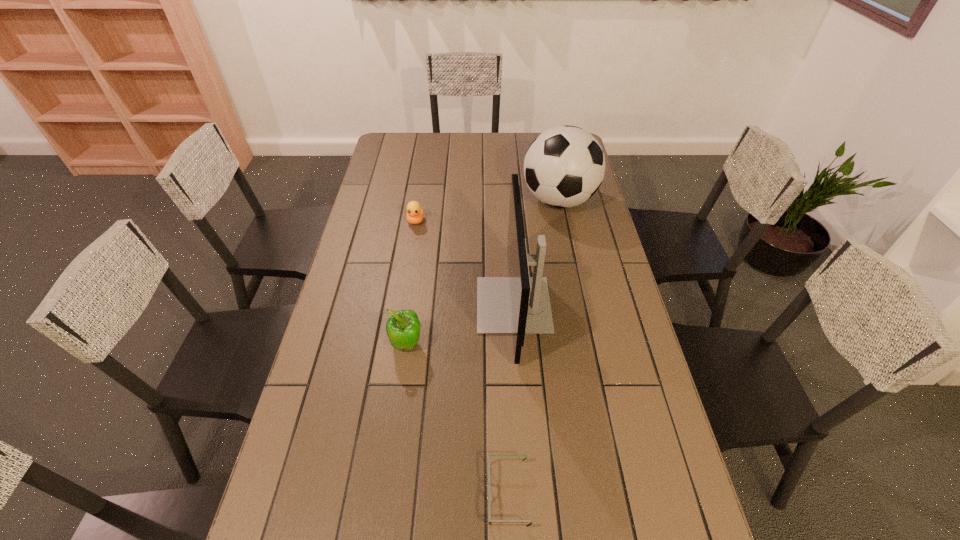
This screenshot has width=960, height=540. Identify the location of computer monitor. (519, 304).

This screenshot has width=960, height=540. Find the location of `soccer ball`. soccer ball is located at coordinates (564, 166).

This screenshot has width=960, height=540. I want to click on bell pepper, so click(403, 329).

Identify the location of duckling. The width and height of the screenshot is (960, 540). point(415,214).

At what (x,y) coordinates should I click in order to perform the action: click on spectacles. Please return your answer as a coordinate pair (x, y). The image size is (960, 540). Looking at the image, I should click on [489, 491].

The image size is (960, 540). I want to click on the nearest object, so click(x=489, y=491).

This screenshot has height=540, width=960. What are the coordinates of `free region located on the screen of the computer monitor` in the screenshot? It's located at (435, 305).

What are the coordinates of `free region located on the screen of the computer monitor` in the screenshot? It's located at (364, 305).

Identify the location of vacant space situated 0.360m on the screen of the computer monitor. (361, 305).

Where is `vacant space positioned 0.120m on the left of the soccer ball`? This screenshot has height=540, width=960. vacant space positioned 0.120m on the left of the soccer ball is located at coordinates [x=491, y=200].